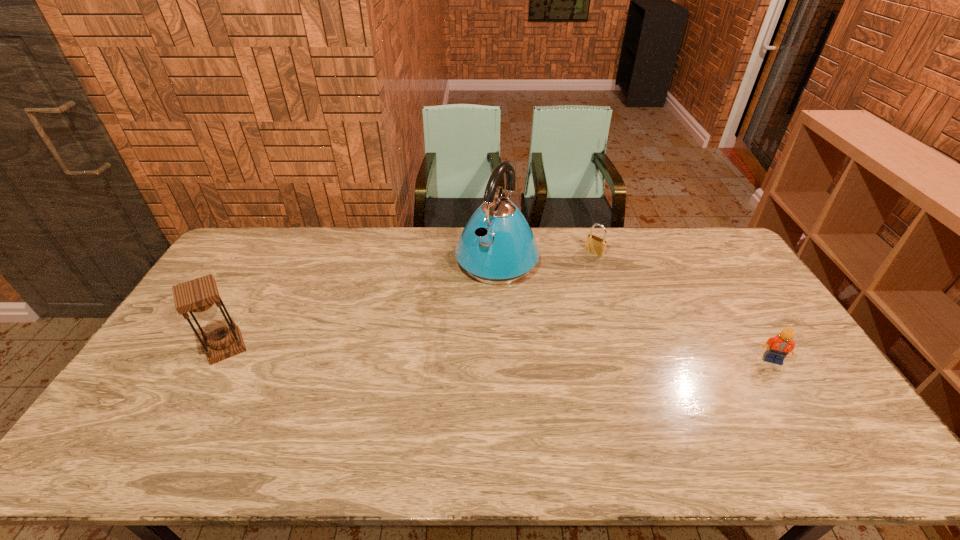
Image resolution: width=960 pixels, height=540 pixels. Identify the location of vacant area between the second tallest object and the second object from right to left. (410, 300).

What are the coordinates of `vacant region between the Lego and the third shortest object` in the screenshot? It's located at coord(499,353).

Identify the location of vacant area that lies between the tallest object and the hourglass. (361, 303).

At what (x,y) coordinates should I click in order to perform the action: click on vacant space that is in between the hourglass and the Lego. Please return your answer as a coordinate pair (x, y). Looking at the image, I should click on (499, 353).

The image size is (960, 540). I want to click on object that is the closest to the Lego, so click(595, 245).

Where is `object identified as the second closest to the rightmost object`? object identified as the second closest to the rightmost object is located at coordinates (497, 246).

Locate an element on the screen. The width and height of the screenshot is (960, 540). free space that satisfies the following two spatial constraints: 1. on the back side of the third object from right to left; 2. on the left side of the second object from right to left is located at coordinates (496, 252).